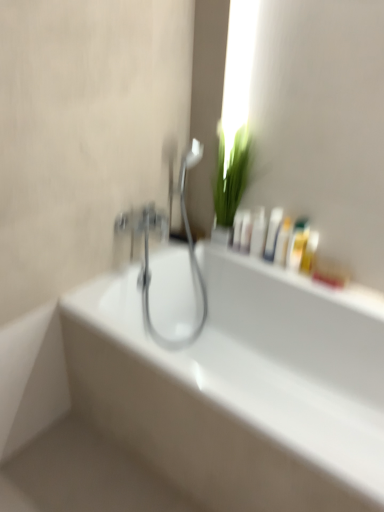
Locate an element on the screen. blank space situated above white glossy bottles at upper center (from a real-world perspective) is located at coordinates (327, 276).